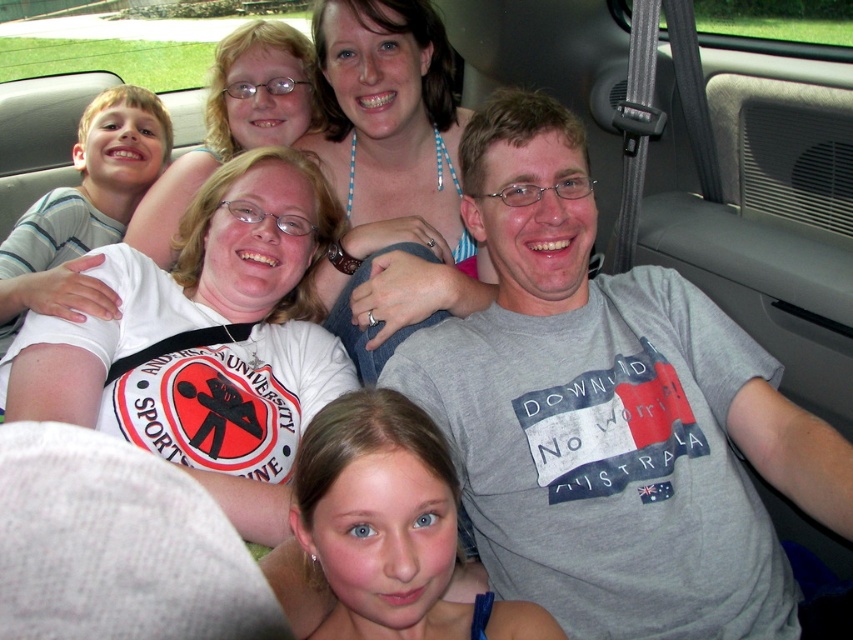
You are a photographer standing 5 feet away from the blue beaded necklace at upper center in the vehicle. Can you reach it without moving closer?

The blue beaded necklace at upper center is 4.65 feet away from the viewer. Since you are standing 5 feet away, you cannot reach it without moving closer.

You are a photographer taking a picture of the blue beaded necklace at upper center and the blue fabric at lower center. Which object is positioned to the left side of the other?

The blue beaded necklace at upper center is positioned to the left of the blue fabric at lower center.

You are a photographer trying to capture a closeup of the blue beaded necklace at upper center and the striped cotton shirt at left. Since you want to focus on the necklace, which object should you move closer to the camera to ensure the necklace appears larger in the photo?

The blue beaded necklace at upper center has a lesser width compared to striped cotton shirt at left. To make the necklace appear larger in the photo, you should move the blue beaded necklace at upper center closer to the camera.